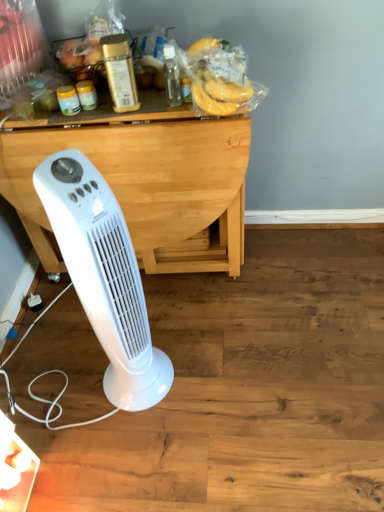
Question: Considering their positions, is gold metallic container at upper center, the second bottle viewed from the right, located in front of or behind yellow matte bananas at upper center?

Choices:
 (A) behind
 (B) front

Answer: (B)

Question: From a real-world perspective, is gold metallic container at upper center, the first bottle positioned from the left, above or below yellow matte bananas at upper center?

Choices:
 (A) above
 (B) below

Answer: (A)

Question: Which is nearer to the gold metallic container at upper center, the second bottle viewed from the right?

Choices:
 (A) transparent plastic bottle at center, which ranks as the first bottle in right-to-left order
 (B) white plastic tower fan at lower left
 (C) yellow matte bananas at upper center
 (D) wooden table at center

Answer: (A)

Question: Which of these objects is positioned farthest from the gold metallic container at upper center, the first bottle positioned from the left?

Choices:
 (A) yellow matte bananas at upper center
 (B) white plastic tower fan at lower left
 (C) wooden table at center
 (D) transparent plastic bottle at center, which ranks as the first bottle in right-to-left order

Answer: (B)